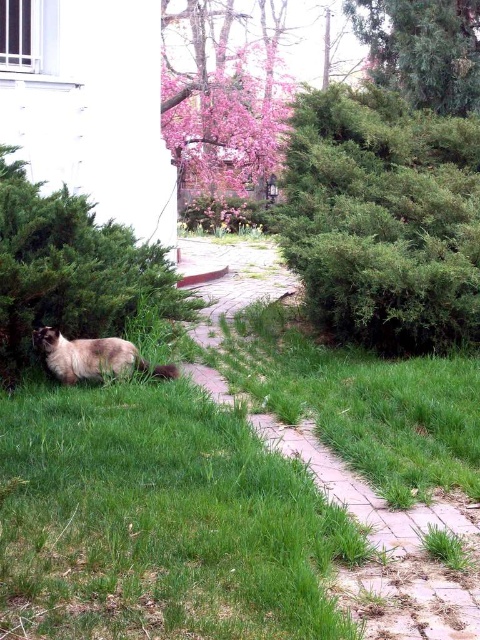
Question: Which point appears closest to the camera in this image?

Choices:
 (A) (126, 365)
 (B) (414, 353)

Answer: (A)

Question: Estimate the real-world distances between objects in this image. Which object is farther from the green leafy bush at lower left?

Choices:
 (A) green textured bush at upper right
 (B) green grass at center

Answer: (A)

Question: Does pink blossom tree at upper center come behind soft fur cat at lower left?

Choices:
 (A) yes
 (B) no

Answer: (A)

Question: Is the position of green textured bush at center less distant than that of green leafy bush at lower left?

Choices:
 (A) yes
 (B) no

Answer: (B)

Question: Is the position of pink blossom tree at upper center less distant than that of soft fur cat at lower left?

Choices:
 (A) yes
 (B) no

Answer: (B)

Question: Which point is farther to the camera?

Choices:
 (A) (398, 214)
 (B) (105, 344)

Answer: (A)